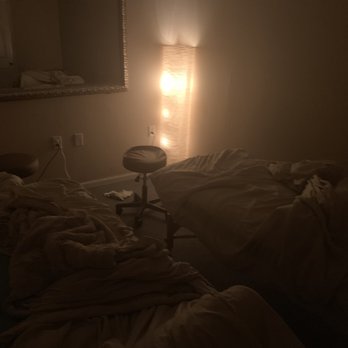
Locate an element on the screen. Image resolution: width=348 pixels, height=348 pixels. corner is located at coordinates (170, 82).